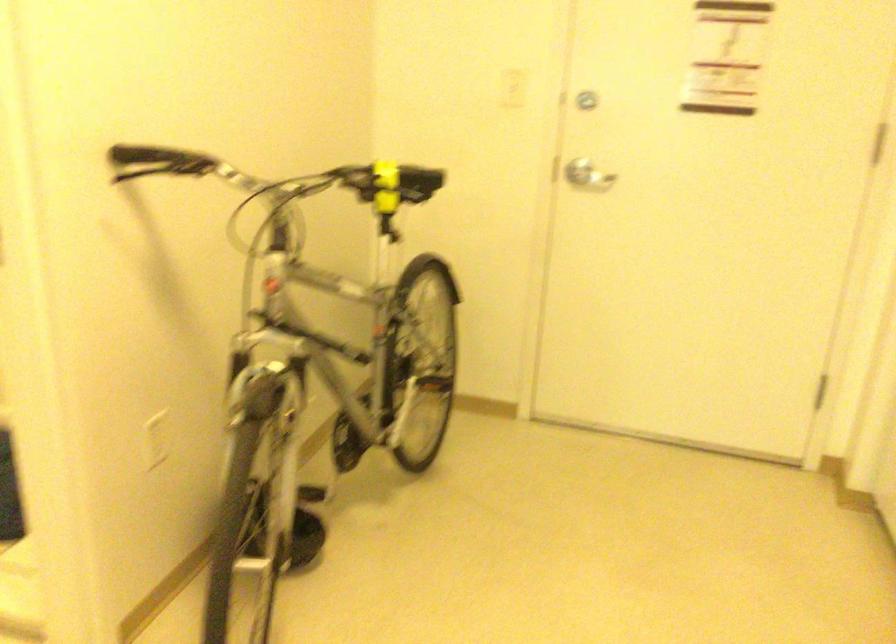
Describe the element at coordinates (152, 155) in the screenshot. I see `the black handlebar grip` at that location.